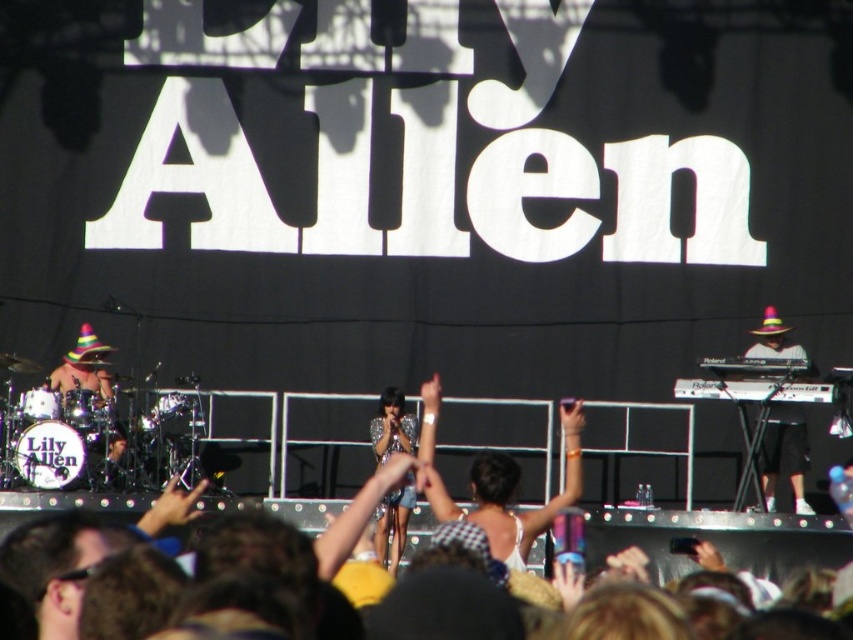
You are a photographer at the concert and want to capture the white fabric dress at center. What are the coordinates where you should focus your camera?

The white fabric dress at center is located at coordinates point (497, 483).

You are a photographer at the concert and want to capture a shot that includes both the purple felt hat at right and the sparkly silver dress at center. Based on their positions, which object should you focus on first to ensure both are in frame?

Since the purple felt hat at right is positioned to the right of the sparkly silver dress at center, you should focus on the sparkly silver dress at center first to ensure both are in frame.